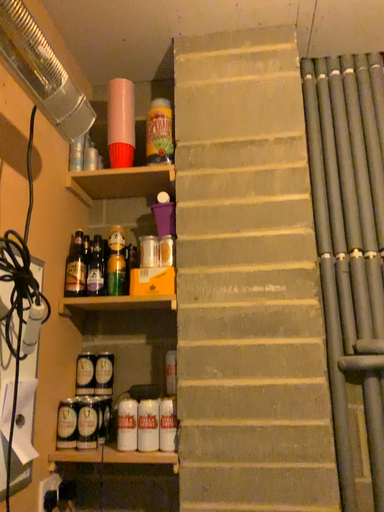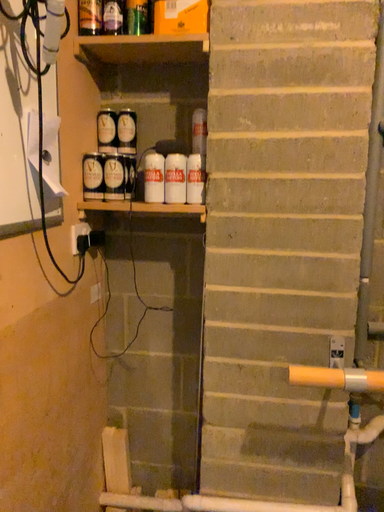
Question: Which way did the camera rotate in the video?

Choices:
 (A) rotated downward
 (B) rotated upward

Answer: (A)